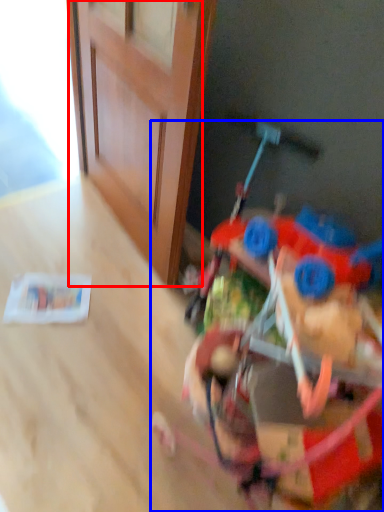
Question: Which object appears farthest to the camera in this image, door (highlighted by a red box) or toy (highlighted by a blue box)?

Choices:
 (A) door
 (B) toy

Answer: (A)